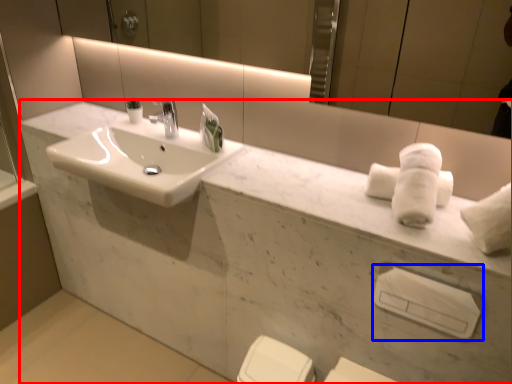
Question: Which object appears closest to the camera in this image, porcelain (highlighted by a red box) or towel bar (highlighted by a blue box)?

Choices:
 (A) porcelain
 (B) towel bar

Answer: (A)